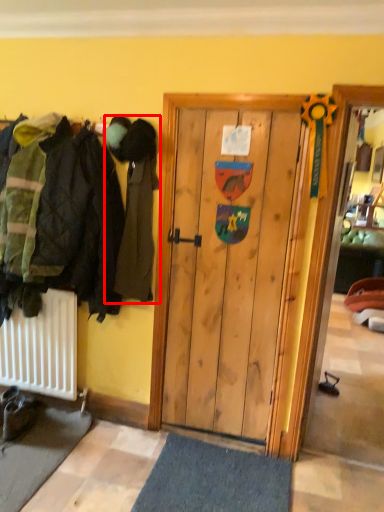
Question: Observing the image, what is the correct spatial positioning of person (annotated by the red box) in reference to footwear?

Choices:
 (A) left
 (B) right

Answer: (B)